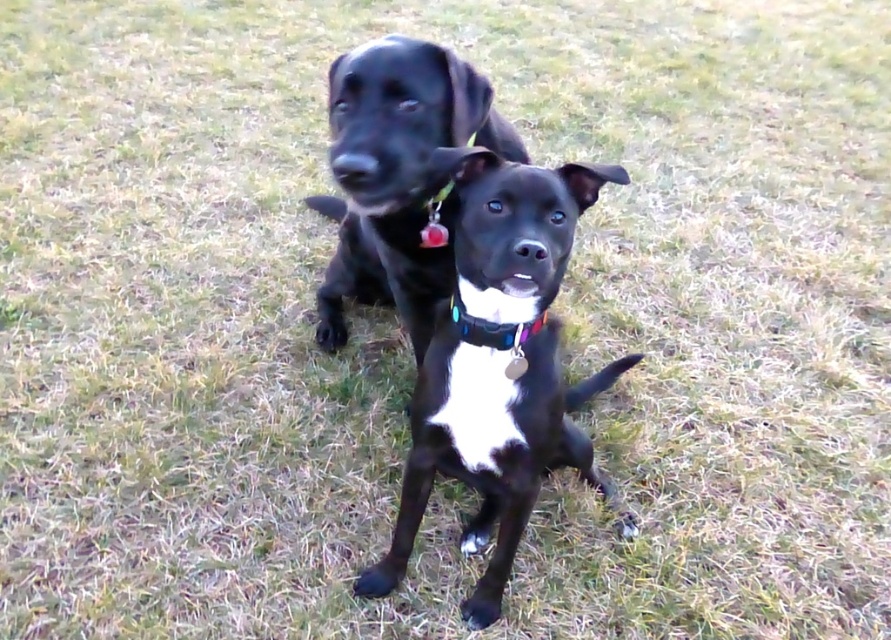
Is shiny black dog at center smaller than multicolored fabric neckband at center?

No, shiny black dog at center is not smaller than multicolored fabric neckband at center.

Can you confirm if shiny black dog at center is shorter than multicolored fabric neckband at center?

No, shiny black dog at center is not shorter than multicolored fabric neckband at center.

Is point (386, 92) behind point (477, 339)?

Yes, it is behind point (477, 339).

What are the coordinates of `shiny black dog at center` in the screenshot? It's located at (396, 177).

Does point (432, 467) come behind point (421, 202)?

Yes, point (432, 467) is behind point (421, 202).

From the picture: Is black shiny dog at center closer to camera compared to shiny black dog at center?

Yes.

Measure the distance between black shiny dog at center and camera.

black shiny dog at center and camera are 3.36 feet apart from each other.

Where is `black shiny dog at center`? The height and width of the screenshot is (640, 891). black shiny dog at center is located at coordinates (489, 448).

Does black shiny dog at center appear over multicolored fabric neckband at center?

Actually, black shiny dog at center is below multicolored fabric neckband at center.

Can you confirm if black shiny dog at center is positioned to the left of multicolored fabric neckband at center?

No, black shiny dog at center is not to the left of multicolored fabric neckband at center.

Which is in front, point (495, 182) or point (473, 333)?

Positioned in front is point (495, 182).

I want to click on black shiny dog at center, so click(489, 448).